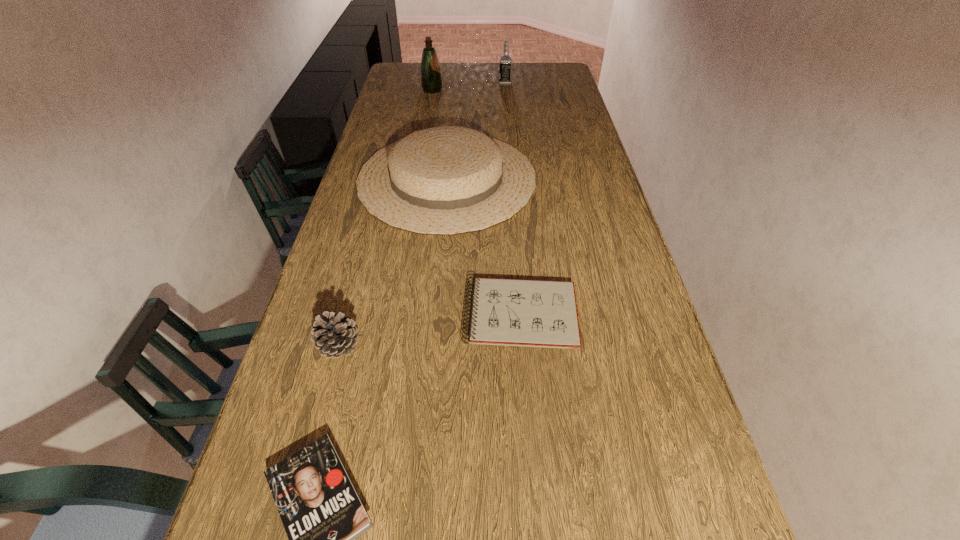
At what (x,y) coordinates should I click in order to perform the action: click on the second farthest object. Please return your answer as a coordinate pair (x, y). This screenshot has height=540, width=960. Looking at the image, I should click on (431, 82).

At what (x,y) coordinates should I click in order to perform the action: click on the tallest object. Please return your answer as a coordinate pair (x, y). This screenshot has height=540, width=960. Looking at the image, I should click on (431, 82).

At what (x,y) coordinates should I click in order to perform the action: click on the second tallest object. Please return your answer as a coordinate pair (x, y). The height and width of the screenshot is (540, 960). Looking at the image, I should click on (505, 66).

Locate an element on the screen. The image size is (960, 540). vodka is located at coordinates (505, 66).

In order to click on sunhat in this screenshot , I will do [x=447, y=180].

You are a GUI agent. You are given a task and a screenshot of the screen. Output one action in this format:
    pyautogui.click(x=<x>, y=<y>)
    Task: Click on the pinecone
    This screenshot has width=960, height=540.
    Given the screenshot: What is the action you would take?
    pyautogui.click(x=335, y=335)

This screenshot has height=540, width=960. I want to click on notepad, so click(534, 313).

Find the location of `vacant space located 0.270m on the front-facing side of the tallest object`. vacant space located 0.270m on the front-facing side of the tallest object is located at coordinates (503, 90).

I want to click on vacant point located 0.200m on the front label of the second tallest object, so click(455, 83).

Where is `vacant space located on the front label of the second tallest object`? Image resolution: width=960 pixels, height=540 pixels. vacant space located on the front label of the second tallest object is located at coordinates (412, 83).